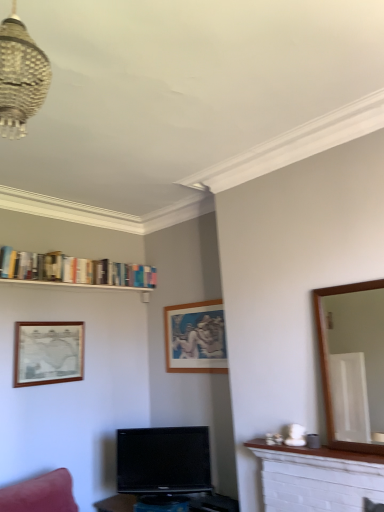
This screenshot has height=512, width=384. In order to click on brown wooden mirror at right in this screenshot , I will do `click(352, 362)`.

Locate an element on the screen. This screenshot has width=384, height=512. black glossy tv at center is located at coordinates (163, 461).

This screenshot has height=512, width=384. What do you see at coordinates (195, 338) in the screenshot? I see `wooden picture frame at center, the 2th picture frame from the left` at bounding box center [195, 338].

The image size is (384, 512). I want to click on brown wooden mirror at right, so click(352, 362).

Considering the positions of objects hardcover books at upper left and metallic woven chandelier at upper left in the image provided, who is behind, hardcover books at upper left or metallic woven chandelier at upper left?

hardcover books at upper left is further from the camera.

Is hardcover books at upper left at the right side of metallic woven chandelier at upper left?

No.

Is hardcover books at upper left facing towards metallic woven chandelier at upper left?

Yes, hardcover books at upper left is turned towards metallic woven chandelier at upper left.

From a real-world perspective, is hardcover books at upper left above or below metallic woven chandelier at upper left?

hardcover books at upper left is situated lower than metallic woven chandelier at upper left in the real world.

From the image's perspective, is hardcover books at upper left positioned above or below wooden picture frame at center, acting as the 1th picture frame starting from the right?

From the image's perspective, hardcover books at upper left appears above wooden picture frame at center, acting as the 1th picture frame starting from the right.

Is hardcover books at upper left smaller than wooden picture frame at center, the 2th picture frame from the left?

Actually, hardcover books at upper left might be larger than wooden picture frame at center, the 2th picture frame from the left.

Considering the positions of objects hardcover books at upper left and wooden picture frame at center, acting as the 1th picture frame starting from the right, in the image provided, who is behind, hardcover books at upper left or wooden picture frame at center, acting as the 1th picture frame starting from the right,?

wooden picture frame at center, acting as the 1th picture frame starting from the right, is behind.

Can you confirm if hardcover books at upper left is positioned to the left of wooden picture frame at center, acting as the 1th picture frame starting from the right?

Yes, hardcover books at upper left is to the left of wooden picture frame at center, acting as the 1th picture frame starting from the right.

Is white marble mantle at lower right smaller than wooden picture frame at left, which is the 1th picture frame in left-to-right order?

Indeed, white marble mantle at lower right has a smaller size compared to wooden picture frame at left, which is the 1th picture frame in left-to-right order.

From the picture: Is white marble mantle at lower right oriented towards wooden picture frame at left, arranged as the 2th picture frame when viewed from the right?

No, white marble mantle at lower right does not turn towards wooden picture frame at left, arranged as the 2th picture frame when viewed from the right.

Based on the photo, what's the angular difference between white marble mantle at lower right and wooden picture frame at left, arranged as the 2th picture frame when viewed from the right,'s facing directions?

There is a 90.9-degree angle between the facing directions of white marble mantle at lower right and wooden picture frame at left, arranged as the 2th picture frame when viewed from the right.

This screenshot has width=384, height=512. I want to click on picture frame that is the 1st one above the white marble mantle at lower right (from a real-world perspective), so click(x=48, y=352).

From the picture: From a real-world perspective, is wooden picture frame at left, which is the 1th picture frame in left-to-right order, positioned above or below white marble mantle at lower right?

From a real-world perspective, wooden picture frame at left, which is the 1th picture frame in left-to-right order, is physically above white marble mantle at lower right.

Is wooden picture frame at left, arranged as the 2th picture frame when viewed from the right, wider or thinner than white marble mantle at lower right?

In the image, wooden picture frame at left, arranged as the 2th picture frame when viewed from the right, appears to be more narrow than white marble mantle at lower right.

Is wooden picture frame at left, which is the 1th picture frame in left-to-right order, situated inside white marble mantle at lower right or outside?

wooden picture frame at left, which is the 1th picture frame in left-to-right order, is not inside white marble mantle at lower right, it's outside.

Is hardcover books at upper left closer to the viewer compared to brown wooden mirror at right?

That is False.

Find the location of a particular element. This screenshot has height=512, width=384. book positioned vertically above the brown wooden mirror at right (from a real-world perspective) is located at coordinates (74, 269).

Consider the image. Considering the sizes of objects hardcover books at upper left and brown wooden mirror at right in the image provided, who is smaller, hardcover books at upper left or brown wooden mirror at right?

brown wooden mirror at right.

Which of these two, hardcover books at upper left or brown wooden mirror at right, is thinner?

brown wooden mirror at right.

From a real-world perspective, is hardcover books at upper left physically located above or below white brick fireplace at lower right?

In terms of real-world spatial position, hardcover books at upper left is above white brick fireplace at lower right.

Consider the image. Is hardcover books at upper left touching white brick fireplace at lower right?

No, hardcover books at upper left is not beside white brick fireplace at lower right.

Relative to white brick fireplace at lower right, is hardcover books at upper left in front or behind?

In the image, hardcover books at upper left appears behind white brick fireplace at lower right.

Is hardcover books at upper left looking in the opposite direction of white brick fireplace at lower right?

No, hardcover books at upper left's orientation is not away from white brick fireplace at lower right.

Is wooden picture frame at left, arranged as the 2th picture frame when viewed from the right, beside brown wooden mirror at right?

No, wooden picture frame at left, arranged as the 2th picture frame when viewed from the right, is not in contact with brown wooden mirror at right.

Which is in front, wooden picture frame at left, arranged as the 2th picture frame when viewed from the right, or brown wooden mirror at right?

brown wooden mirror at right is more forward.

You are a GUI agent. You are given a task and a screenshot of the screen. Output one action in this format:
    pyautogui.click(x=<x>, y=<y>)
    Task: Click on the mirror below the wooden picture frame at left, which is the 1th picture frame in left-to-right order (from a real-world perspective)
    
    Given the screenshot: What is the action you would take?
    pyautogui.click(x=352, y=362)

What are the coordinates of `book located behind the metallic woven chandelier at upper left` in the screenshot? It's located at (74, 269).

You are a GUI agent. You are given a task and a screenshot of the screen. Output one action in this format:
    pyautogui.click(x=<x>, y=<y>)
    Task: Click on the picture frame on the right side of hardcover books at upper left
    
    Given the screenshot: What is the action you would take?
    pyautogui.click(x=195, y=338)

Based on their spatial positions, is wooden picture frame at left, arranged as the 2th picture frame when viewed from the right, or brown wooden mirror at right closer to wooden picture frame at center, acting as the 1th picture frame starting from the right?

The object closer to wooden picture frame at center, acting as the 1th picture frame starting from the right, is wooden picture frame at left, arranged as the 2th picture frame when viewed from the right.

When comparing their distances from wooden picture frame at center, acting as the 1th picture frame starting from the right, does white marble mantle at lower right or brown wooden mirror at right seem closer?

white marble mantle at lower right lies closer to wooden picture frame at center, acting as the 1th picture frame starting from the right, than the other object.

Estimate the real-world distances between objects in this image. Which object is further from white marble mantle at lower right, black glossy tv at center or hardcover books at upper left?

Based on the image, hardcover books at upper left appears to be further to white marble mantle at lower right.

When comparing their distances from hardcover books at upper left, does wooden picture frame at center, the 2th picture frame from the left, or wooden picture frame at left, arranged as the 2th picture frame when viewed from the right, seem further?

Among the two, wooden picture frame at center, the 2th picture frame from the left, is located further to hardcover books at upper left.

Which object lies further to the anchor point white marble mantle at lower right, metallic woven chandelier at upper left or white brick fireplace at lower right?

metallic woven chandelier at upper left.

When comparing their distances from white brick fireplace at lower right, does metallic woven chandelier at upper left or hardcover books at upper left seem closer?

hardcover books at upper left lies closer to white brick fireplace at lower right than the other object.

When comparing their distances from black glossy tv at center, does white marble mantle at lower right or metallic woven chandelier at upper left seem closer?

Among the two, white marble mantle at lower right is located nearer to black glossy tv at center.

Which object lies nearer to the anchor point wooden picture frame at left, arranged as the 2th picture frame when viewed from the right, metallic woven chandelier at upper left or white brick fireplace at lower right?

Based on the image, white brick fireplace at lower right appears to be nearer to wooden picture frame at left, arranged as the 2th picture frame when viewed from the right.

You are a GUI agent. You are given a task and a screenshot of the screen. Output one action in this format:
    pyautogui.click(x=<x>, y=<y>)
    Task: Click on the picture frame between hardcover books at upper left and brown wooden mirror at right in the horizontal direction
    
    Given the screenshot: What is the action you would take?
    pyautogui.click(x=195, y=338)

Find the location of `television between wooden picture frame at left, arranged as the 2th picture frame when viewed from the right, and brown wooden mirror at right, in the horizontal direction`. television between wooden picture frame at left, arranged as the 2th picture frame when viewed from the right, and brown wooden mirror at right, in the horizontal direction is located at coordinates (163, 461).

Locate an element on the screen. This screenshot has height=512, width=384. mantle between metallic woven chandelier at upper left and wooden picture frame at left, which is the 1th picture frame in left-to-right order, from front to back is located at coordinates (318, 451).

At what (x,y) coordinates should I click in order to perform the action: click on fireplace located between metallic woven chandelier at upper left and wooden picture frame at center, the 2th picture frame from the left, in the depth direction. Please return your answer as a coordinate pair (x, y). The width and height of the screenshot is (384, 512). Looking at the image, I should click on (317, 478).